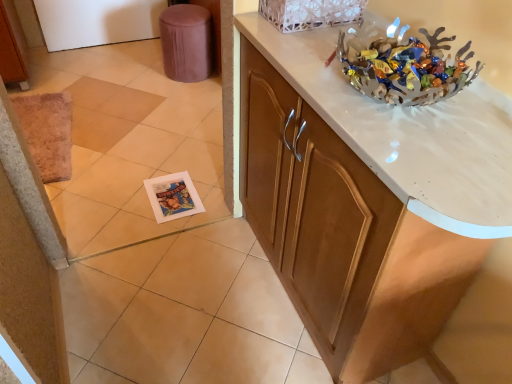
Question: Is white lace basket at upper center positioned behind metallic silver bowl at upper right?

Choices:
 (A) yes
 (B) no

Answer: (A)

Question: From the image's perspective, is white lace basket at upper center located above metallic silver bowl at upper right?

Choices:
 (A) yes
 (B) no

Answer: (A)

Question: Is the position of white lace basket at upper center less distant than that of metallic silver bowl at upper right?

Choices:
 (A) yes
 (B) no

Answer: (B)

Question: Can you confirm if white lace basket at upper center is thinner than metallic silver bowl at upper right?

Choices:
 (A) no
 (B) yes

Answer: (B)

Question: From a real-world perspective, is white lace basket at upper center positioned under metallic silver bowl at upper right based on gravity?

Choices:
 (A) yes
 (B) no

Answer: (B)

Question: From a real-world perspective, is metallic silver bowl at upper right positioned above or below white lace basket at upper center?

Choices:
 (A) above
 (B) below

Answer: (B)

Question: Visually, is metallic silver bowl at upper right positioned to the left or to the right of white lace basket at upper center?

Choices:
 (A) left
 (B) right

Answer: (B)

Question: Do you think metallic silver bowl at upper right is within white lace basket at upper center, or outside of it?

Choices:
 (A) outside
 (B) inside

Answer: (A)

Question: From the image's perspective, is metallic silver bowl at upper right positioned above or below white lace basket at upper center?

Choices:
 (A) below
 (B) above

Answer: (A)

Question: From a real-world perspective, relative to white marble countertop at upper right, is white lace basket at upper center vertically above or below?

Choices:
 (A) below
 (B) above

Answer: (B)

Question: Considering the positions of point (340, 3) and point (323, 54), is point (340, 3) closer or farther from the camera than point (323, 54)?

Choices:
 (A) farther
 (B) closer

Answer: (A)

Question: In terms of width, does white lace basket at upper center look wider or thinner when compared to white marble countertop at upper right?

Choices:
 (A) wide
 (B) thin

Answer: (B)

Question: From their relative heights in the image, would you say white lace basket at upper center is taller or shorter than white marble countertop at upper right?

Choices:
 (A) tall
 (B) short

Answer: (B)

Question: From a real-world perspective, is brown fabric stool at upper left physically located above or below metallic silver bowl at upper right?

Choices:
 (A) below
 (B) above

Answer: (A)

Question: From the image's perspective, relative to metallic silver bowl at upper right, is brown fabric stool at upper left above or below?

Choices:
 (A) below
 (B) above

Answer: (B)